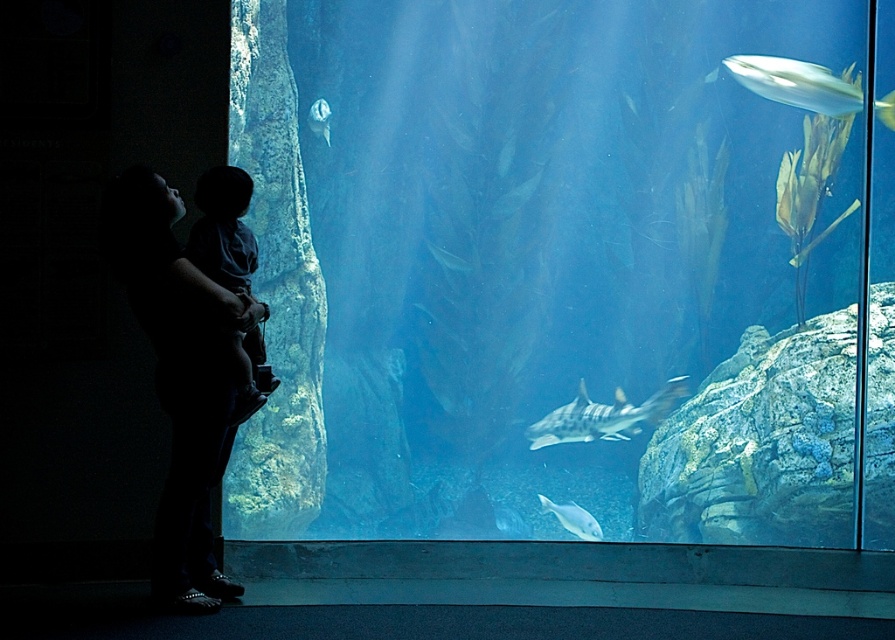
Question: Estimate the real-world distances between objects in this image. Which object is farther from the translucent glass fish at upper center?

Choices:
 (A) speckled gray shark at center
 (B) silhouette fabric at left

Answer: (B)

Question: Can you confirm if dark blue fabric at left is positioned below translucent glass fish at upper center?

Choices:
 (A) no
 (B) yes

Answer: (B)

Question: Which is nearer to the shiny silver fish at upper right?

Choices:
 (A) shiny silver fish at center
 (B) translucent glass fish at upper center
 (C) silhouette fabric at left

Answer: (A)

Question: Which of the following is the closest to the observer?

Choices:
 (A) (244, 202)
 (B) (197, 392)
 (C) (582, 515)
 (D) (316, 116)

Answer: (B)

Question: Is shiny silver fish at upper right positioned behind shiny silver fish at center?

Choices:
 (A) yes
 (B) no

Answer: (B)

Question: Can you confirm if dark blue fabric at left is positioned above speckled gray shark at center?

Choices:
 (A) yes
 (B) no

Answer: (A)